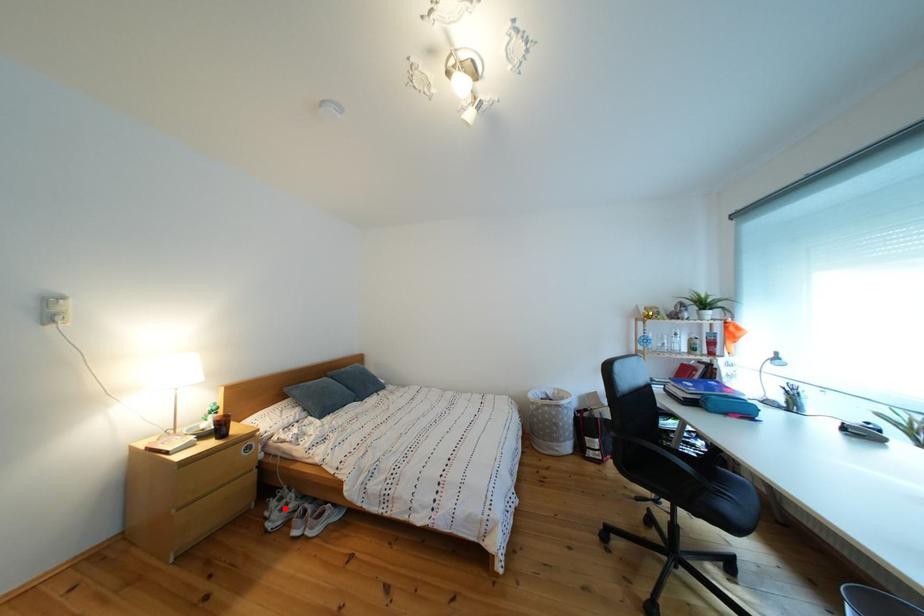
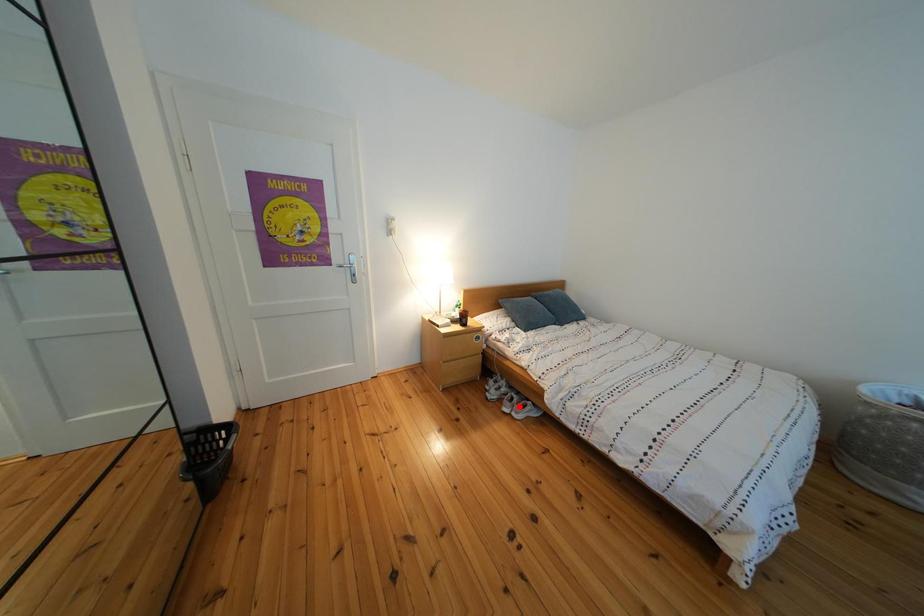
I am providing you with two images of the same scene from different viewpoints. A red point is marked on the first image and another point is marked on the second image. Are the points marked in image1 and image2 representing the same 3D position?

No